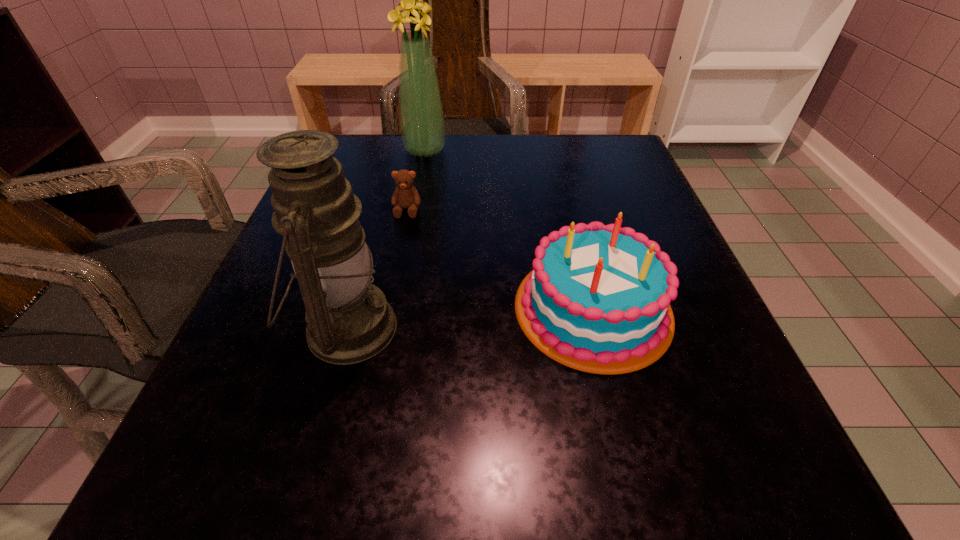
Identify which object is the third nearest to the birthday cake. Please provide its 2D coordinates. Your answer should be formatted as a tuple, i.e. [(x, y)], where the tuple contains the x and y coordinates of a point satisfying the conditions above.

[(422, 125)]

Image resolution: width=960 pixels, height=540 pixels. I want to click on vacant space that satisfies the following two spatial constraints: 1. on the front-facing side of the farthest object; 2. on the back side of the third tallest object, so click(396, 308).

Where is `vacant area in the image that satisfies the following two spatial constraints: 1. on the front-facing side of the bouquet; 2. on the right side of the birthday cake`? The height and width of the screenshot is (540, 960). vacant area in the image that satisfies the following two spatial constraints: 1. on the front-facing side of the bouquet; 2. on the right side of the birthday cake is located at coordinates (396, 308).

The height and width of the screenshot is (540, 960). Identify the location of free space that satisfies the following two spatial constraints: 1. on the front-facing side of the farthest object; 2. on the face of the third nearest object. (414, 210).

You are a GUI agent. You are given a task and a screenshot of the screen. Output one action in this format:
    pyautogui.click(x=<x>, y=<y>)
    Task: Click on the vacant space that satisfies the following two spatial constraints: 1. on the face of the rightmost object; 2. on the left side of the shortest object
    
    Given the screenshot: What is the action you would take?
    pyautogui.click(x=387, y=308)

At what (x,y) coordinates should I click in order to perform the action: click on free location that satisfies the following two spatial constraints: 1. on the front-facing side of the farthest object; 2. on the back side of the second shortest object. Please return your answer as a coordinate pair (x, y). This screenshot has height=540, width=960. Looking at the image, I should click on (396, 308).

You are a GUI agent. You are given a task and a screenshot of the screen. Output one action in this format:
    pyautogui.click(x=<x>, y=<y>)
    Task: Click on the vacant position in the image that satisfies the following two spatial constraints: 1. on the front-facing side of the third tallest object; 2. on the right side of the farthest object
    
    Given the screenshot: What is the action you would take?
    pyautogui.click(x=396, y=308)